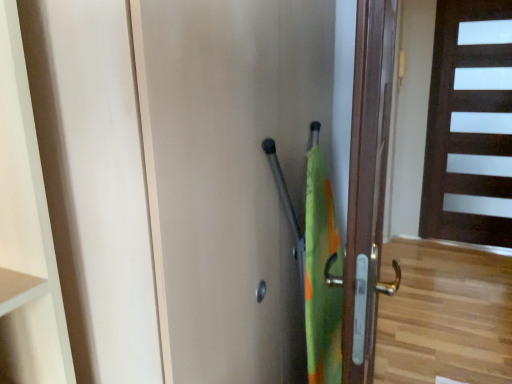
Question: Is brown wooden door at right, which is the second door from right to left, thinner than matte wood door at center, marked as the 3th door in a right-to-left arrangement?

Choices:
 (A) yes
 (B) no

Answer: (B)

Question: Does brown wooden door at right, which is the second door from right to left, touch matte wood door at center, positioned as the 1th door in front-to-back order?

Choices:
 (A) yes
 (B) no

Answer: (B)

Question: Can you confirm if brown wooden door at right, which appears as the 2th door when viewed from the left, is shorter than matte wood door at center, positioned as the 1th door in front-to-back order?

Choices:
 (A) no
 (B) yes

Answer: (B)

Question: Does brown wooden door at right, the 2th door in the front-to-back sequence, have a greater height compared to matte wood door at center, marked as the 3th door in a right-to-left arrangement?

Choices:
 (A) no
 (B) yes

Answer: (A)

Question: Is brown wooden door at right, which is the second door from right to left, aimed at matte wood door at center, positioned as the 1th door in front-to-back order?

Choices:
 (A) yes
 (B) no

Answer: (B)

Question: Is point (210, 289) closer or farther from the camera than point (352, 309)?

Choices:
 (A) closer
 (B) farther

Answer: (A)

Question: Do you think matte wood door at center, the third door positioned from the back, is within brown wooden door at right, which appears as the 2th door when viewed from the left, or outside of it?

Choices:
 (A) outside
 (B) inside

Answer: (A)

Question: Considering the positions of matte wood door at center, positioned as the 1th door in front-to-back order, and brown wooden door at right, which appears as the 2th door when viewed from the left, in the image, is matte wood door at center, positioned as the 1th door in front-to-back order, taller or shorter than brown wooden door at right, which appears as the 2th door when viewed from the left,?

Choices:
 (A) tall
 (B) short

Answer: (A)

Question: Visually, is matte wood door at center, positioned as the 1th door in front-to-back order, positioned to the left or to the right of brown wooden door at right, which appears as the 2th door when viewed from the left?

Choices:
 (A) left
 (B) right

Answer: (A)

Question: Looking at the image, does brown wooden door at right, which is the second door from right to left, seem bigger or smaller compared to matte wood door at center, positioned as the 1th door in front-to-back order?

Choices:
 (A) small
 (B) big

Answer: (A)

Question: Looking at their shapes, would you say brown wooden door at right, the 2th door when ordered from back to front, is wider or thinner than matte wood door at center, the third door positioned from the back?

Choices:
 (A) wide
 (B) thin

Answer: (A)

Question: From a real-world perspective, relative to matte wood door at center, positioned as the 1th door in front-to-back order, is brown wooden door at right, which is the second door from right to left, vertically above or below?

Choices:
 (A) below
 (B) above

Answer: (B)

Question: Relative to matte wood door at center, which is the first door in left-to-right order, is brown wooden door at right, which is the second door from right to left, in front or behind?

Choices:
 (A) front
 (B) behind

Answer: (B)

Question: From a real-world perspective, is dark wood door at right, acting as the first door starting from the right, positioned above or below matte wood door at center, the third door positioned from the back?

Choices:
 (A) above
 (B) below

Answer: (A)

Question: In the image, is dark wood door at right, which is counted as the third door, starting from the left, positioned in front of or behind matte wood door at center, positioned as the 1th door in front-to-back order?

Choices:
 (A) behind
 (B) front

Answer: (A)